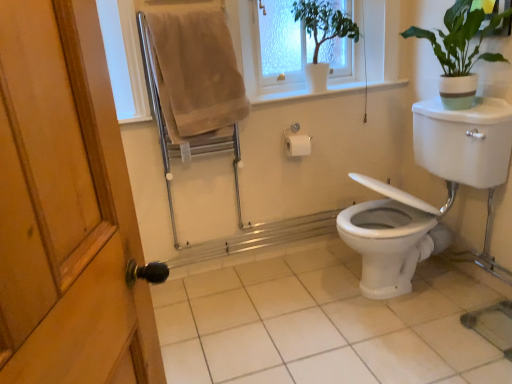
Question: From the image's perspective, is white plastic window frame at upper center above beige cotton towel at upper left?

Choices:
 (A) no
 (B) yes

Answer: (B)

Question: Can you confirm if white plastic window frame at upper center is wider than beige cotton towel at upper left?

Choices:
 (A) no
 (B) yes

Answer: (B)

Question: Is white plastic window frame at upper center not within beige cotton towel at upper left?

Choices:
 (A) yes
 (B) no

Answer: (A)

Question: Is white plastic window frame at upper center to the right of beige cotton towel at upper left from the viewer's perspective?

Choices:
 (A) no
 (B) yes

Answer: (B)

Question: Considering the relative sizes of white plastic window frame at upper center and beige cotton towel at upper left in the image provided, is white plastic window frame at upper center shorter than beige cotton towel at upper left?

Choices:
 (A) yes
 (B) no

Answer: (A)

Question: Does white plastic window frame at upper center have a lesser width compared to beige cotton towel at upper left?

Choices:
 (A) no
 (B) yes

Answer: (A)

Question: Does green matte plant at upper right, the second houseplant from the left, lie behind white glossy pot at upper center, the second houseplant from the right?

Choices:
 (A) yes
 (B) no

Answer: (B)

Question: Is green matte plant at upper right, the second houseplant from the left, facing away from white glossy pot at upper center, positioned as the 1th houseplant in left-to-right order?

Choices:
 (A) no
 (B) yes

Answer: (A)

Question: Is green matte plant at upper right, the second houseplant from the left, to the right of white glossy pot at upper center, positioned as the 1th houseplant in left-to-right order, from the viewer's perspective?

Choices:
 (A) no
 (B) yes

Answer: (B)

Question: From a real-world perspective, is green matte plant at upper right, acting as the 1th houseplant starting from the right, physically below white glossy pot at upper center, the second houseplant from the right?

Choices:
 (A) yes
 (B) no

Answer: (A)

Question: Are green matte plant at upper right, acting as the 1th houseplant starting from the right, and white glossy pot at upper center, positioned as the 1th houseplant in left-to-right order, making contact?

Choices:
 (A) yes
 (B) no

Answer: (B)

Question: Is green matte plant at upper right, acting as the 1th houseplant starting from the right, not inside white glossy pot at upper center, positioned as the 1th houseplant in left-to-right order?

Choices:
 (A) yes
 (B) no

Answer: (A)

Question: Is the position of beige cotton towel at upper left less distant than that of white glossy tile at center?

Choices:
 (A) yes
 (B) no

Answer: (B)